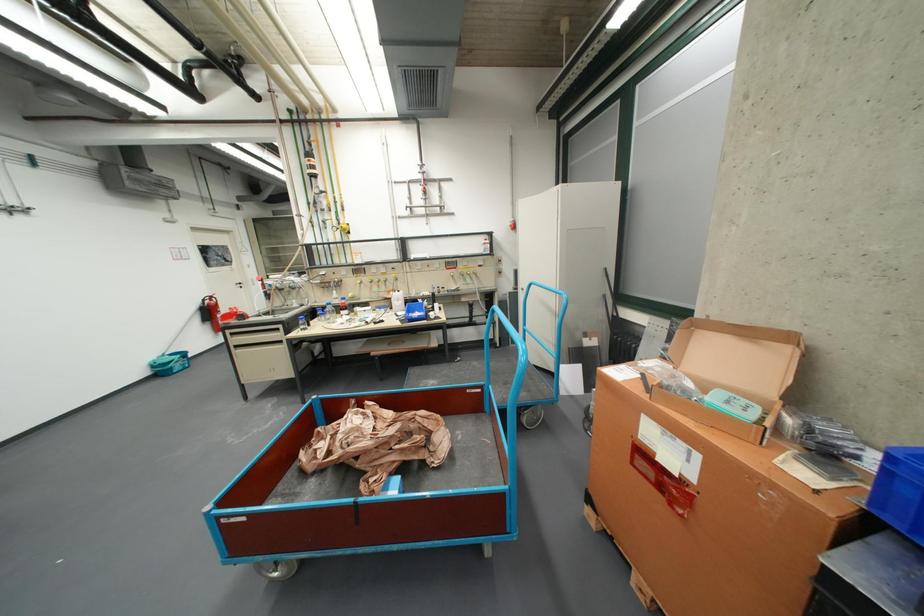
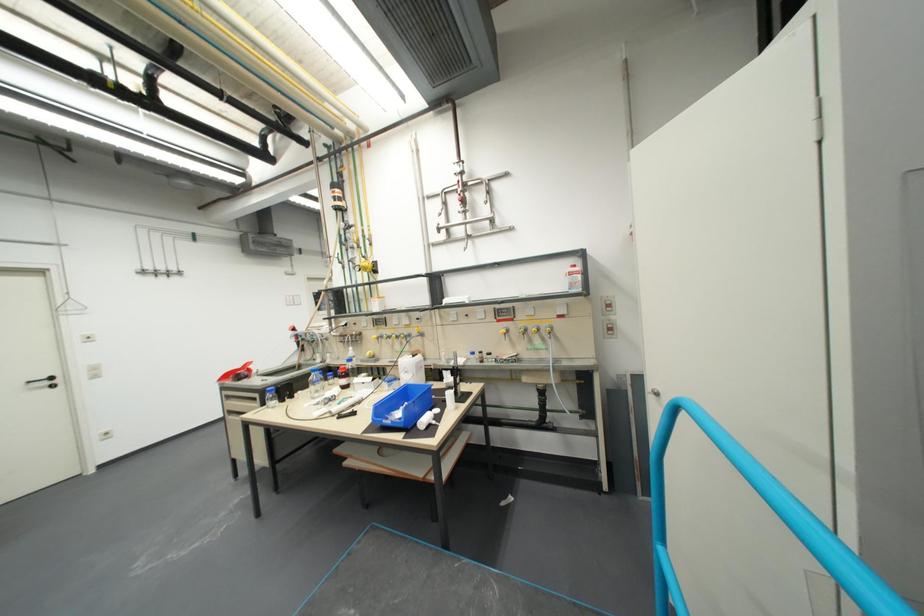
In the second image, find the point that corresponds to pixel 292 326 in the first image.

(269, 397)